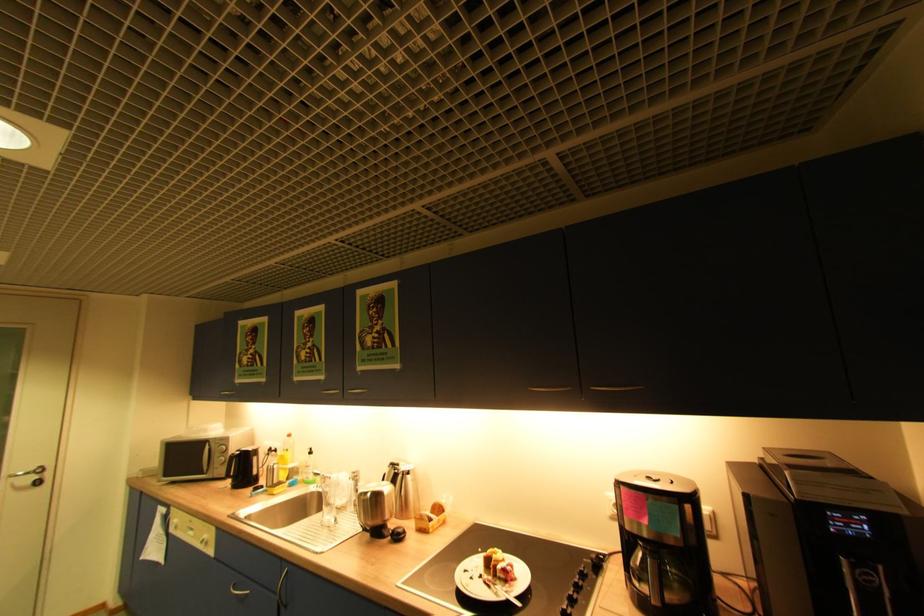
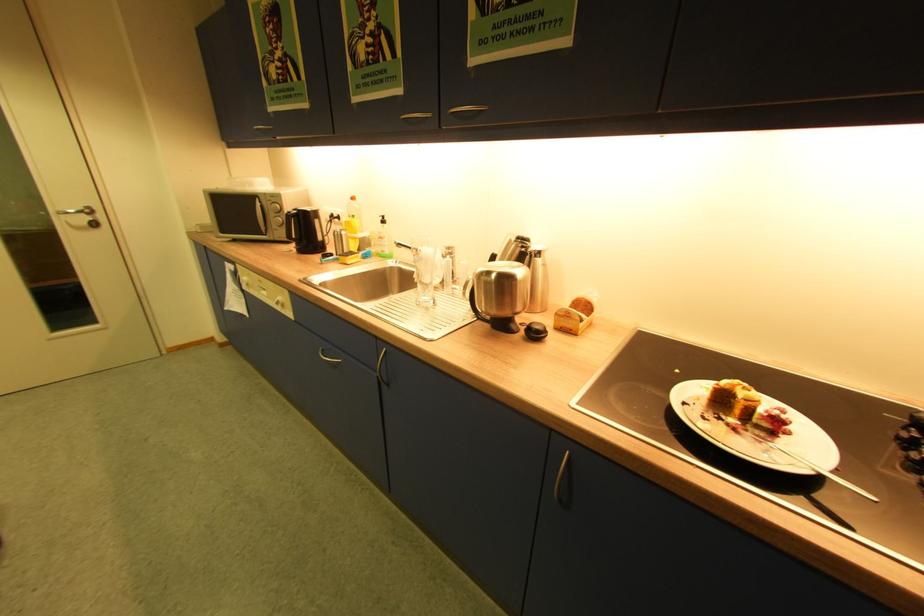
Locate, in the second image, the point that corresponds to the point at 496,586 in the first image.

(746, 432)